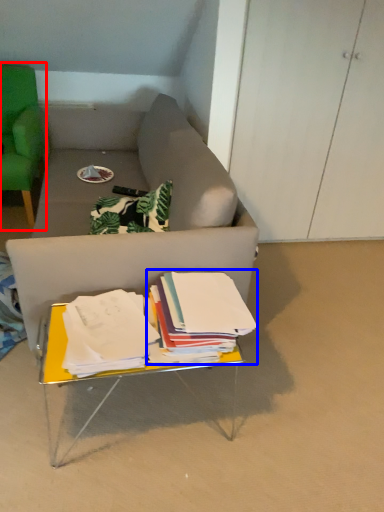
Question: Which of the following is the closest to the observer, chair (highlighted by a red box) or paperback book (highlighted by a blue box)?

Choices:
 (A) chair
 (B) paperback book

Answer: (B)